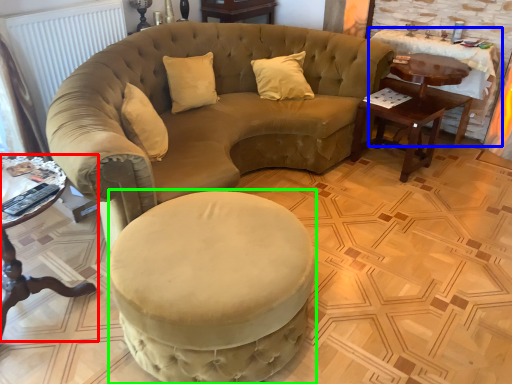
Question: Which object is the farthest from table (highlighted by a red box)? Choose among these: table (highlighted by a blue box) or swivel chair (highlighted by a green box).

Choices:
 (A) table
 (B) swivel chair

Answer: (A)